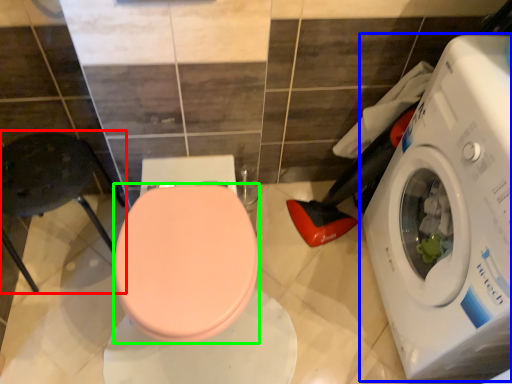
Question: Which object is the farthest from chair (highlighted by a red box)? Choose among these: washing machine (highlighted by a blue box) or bidet (highlighted by a green box).

Choices:
 (A) washing machine
 (B) bidet

Answer: (A)